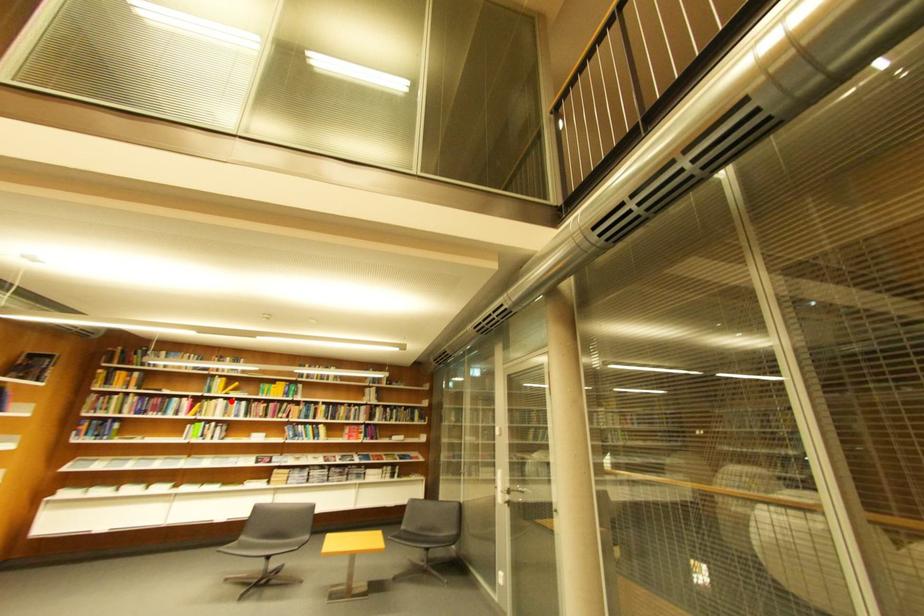
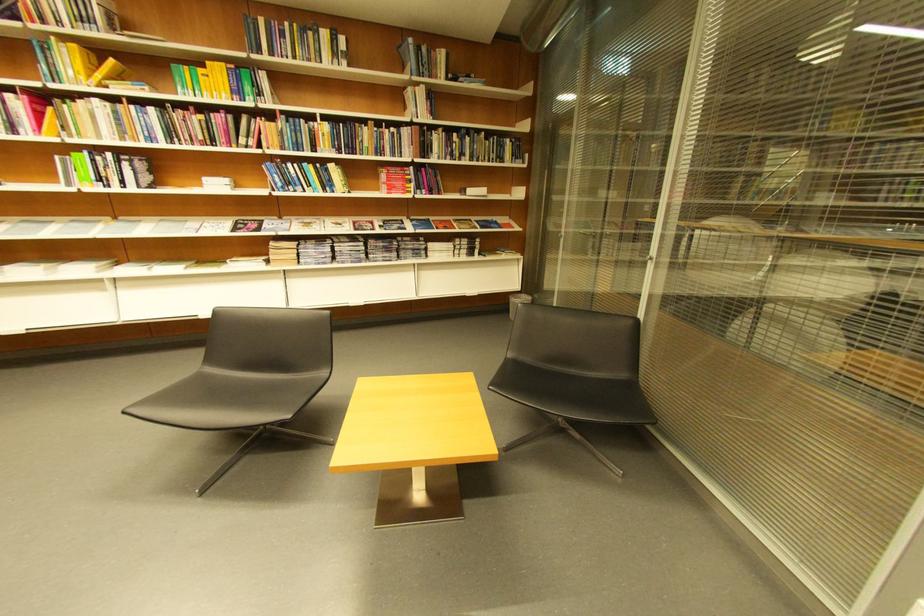
Question: A red point is marked in image1. In image2, is the corresponding 3D point closer to the camera or farther? Reply with the corresponding letter.

Choices:
 (A) The corresponding 3D point is closer.
 (B) The corresponding 3D point is farther.

Answer: (B)